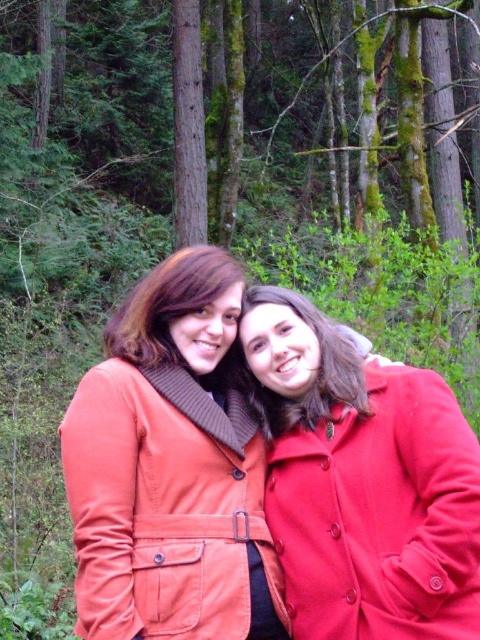
You are a photographer trying to capture a photo of both the matte orange coat at center and the matte red coat at center. Since you want both subjects to appear equally in focus, which coat should you adjust your camera focus on first?

The matte orange coat at center is taller than the matte red coat at center, so you should focus on the matte orange coat at center first to ensure both are in focus.

Based on the photo, you are taking a photo of two people in a forest. The first person is at point (131, 371) and the second person is at point (192, 289). Which person is closer to the camera?

The person at point (131, 371) is closer to the camera than the person at point (192, 289).